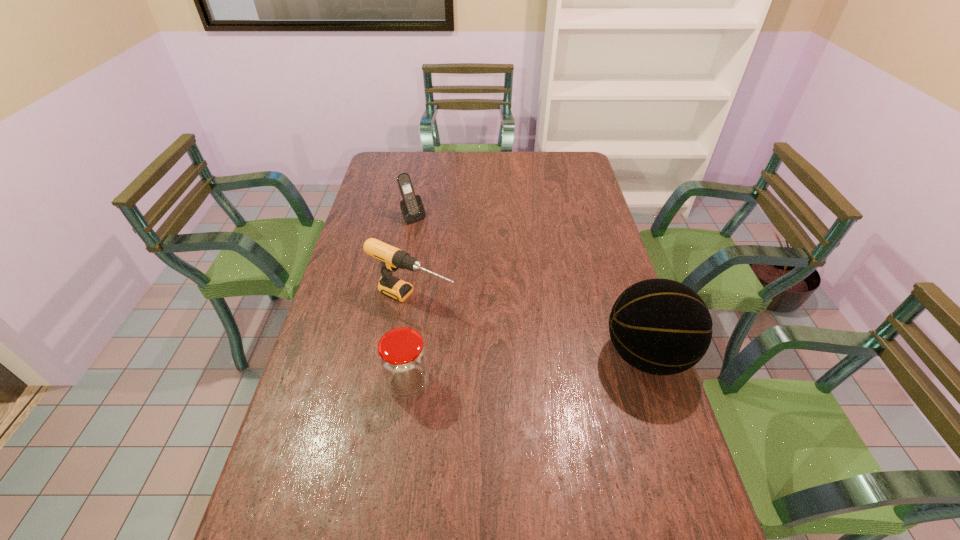
Locate an element on the screen. free spot on the desktop that is between the jar and the tallest object and is positioned on the handle side of the drill is located at coordinates coord(556,366).

Locate an element on the screen. The width and height of the screenshot is (960, 540). free space on the desktop that is between the jar and the rightmost object and is positioned on the front-facing side of the cellular telephone is located at coordinates (555, 366).